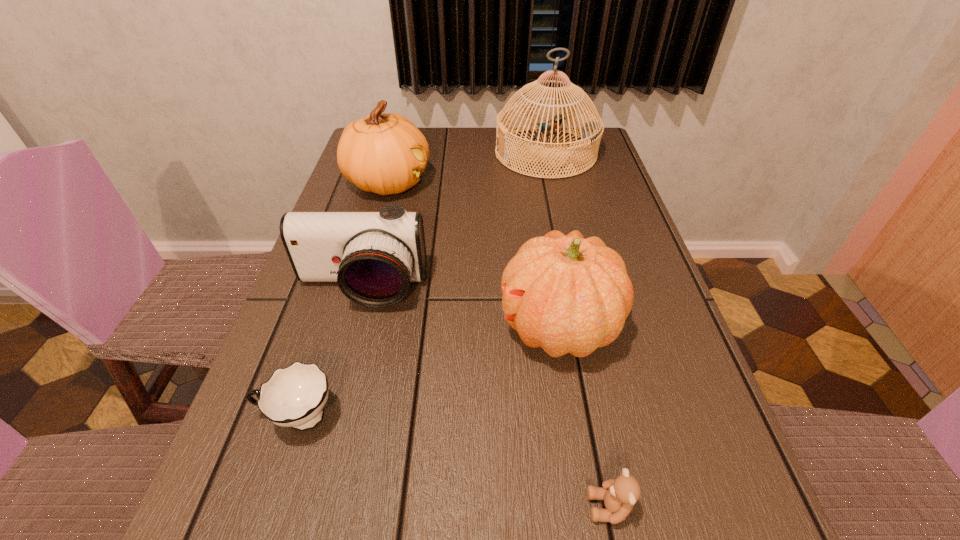
Where is `vacant space that's between the nearest object and the left pumpkin`? The width and height of the screenshot is (960, 540). vacant space that's between the nearest object and the left pumpkin is located at coordinates (499, 345).

Image resolution: width=960 pixels, height=540 pixels. Identify the location of vacant point located between the fifth farthest object and the camcorder. coord(330,353).

Image resolution: width=960 pixels, height=540 pixels. Find the location of `vacant space in between the cup and the birdcage`. vacant space in between the cup and the birdcage is located at coordinates (422, 285).

Find the location of `object that stands as the fourth closest to the tallest object`. object that stands as the fourth closest to the tallest object is located at coordinates (294, 396).

At what (x,y) coordinates should I click in order to perform the action: click on the second closest object to the teddy bear. Please return your answer as a coordinate pair (x, y). Looking at the image, I should click on (294, 396).